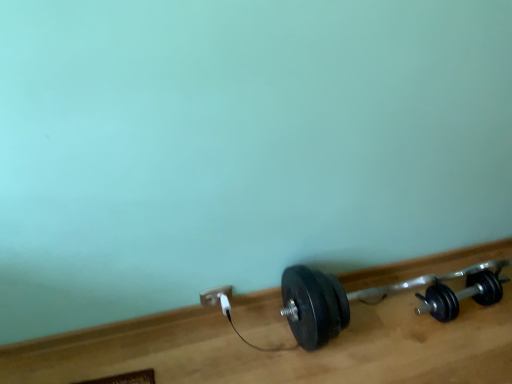
What are the coordinates of `free space in front of white plastic plug at lower center` in the screenshot? It's located at (221, 356).